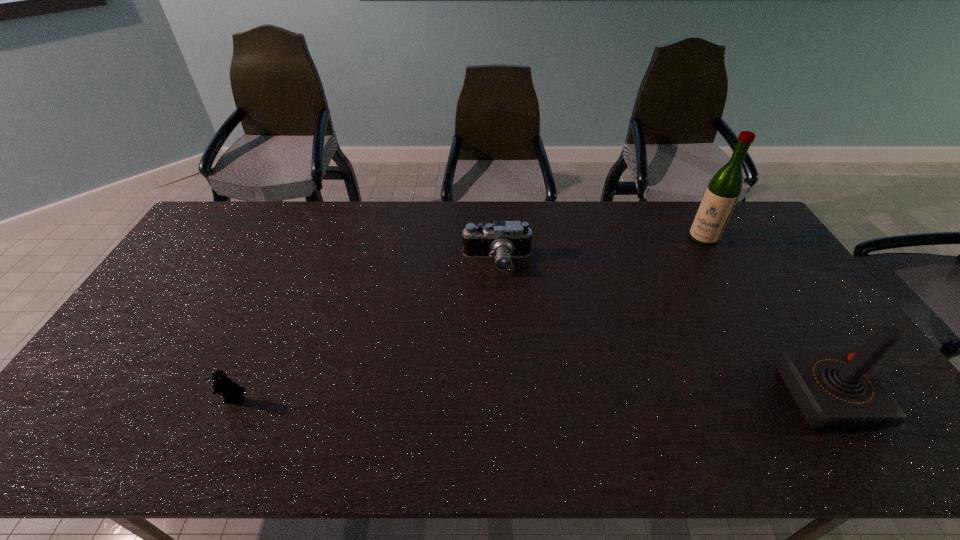
Image resolution: width=960 pixels, height=540 pixels. Identify the location of unoccupied position between the liquor and the Lego. (468, 319).

Where is `vacant region between the tallest object and the Lego`? This screenshot has width=960, height=540. vacant region between the tallest object and the Lego is located at coordinates (468, 319).

Find the location of `unoccupied area between the joystick and the second farthest object`. unoccupied area between the joystick and the second farthest object is located at coordinates (662, 330).

Identify the location of vacant space that's between the liquor and the third nearest object. The width and height of the screenshot is (960, 540). (600, 250).

You are a GUI agent. You are given a task and a screenshot of the screen. Output one action in this format:
    pyautogui.click(x=<x>, y=<y>)
    Task: Click on the object that is the second closest to the Lego
    
    Given the screenshot: What is the action you would take?
    pyautogui.click(x=835, y=390)

Find the location of a particular element. This screenshot has height=540, width=960. object that is the closest one to the third shortest object is located at coordinates (723, 191).

I want to click on free spot that satisfies the following two spatial constraints: 1. on the front side of the joystick; 2. on the rectangular base of the third object from right to left, so click(503, 398).